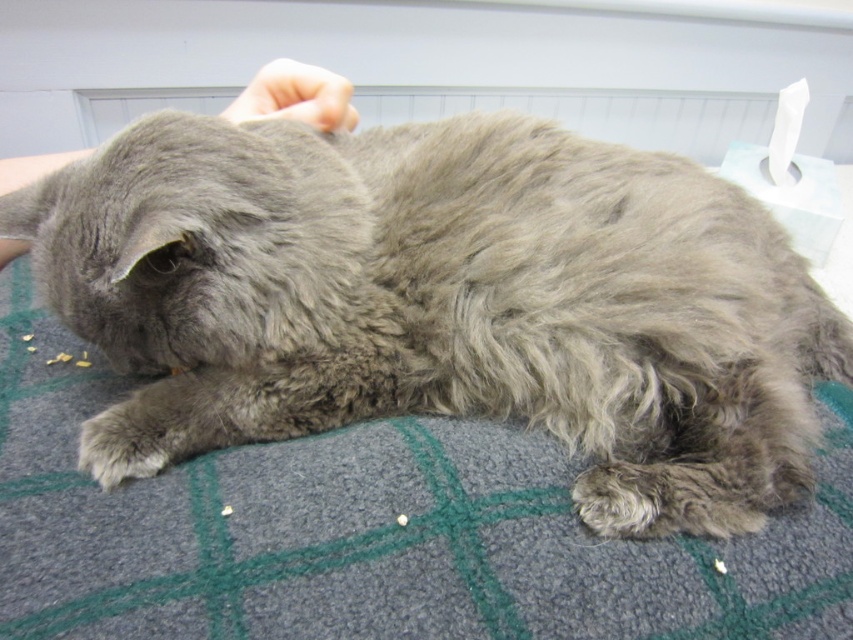
Is gray fluffy cat at center bigger than smooth skin hand at upper center?

Correct, gray fluffy cat at center is larger in size than smooth skin hand at upper center.

Is gray fluffy cat at center further to camera compared to smooth skin hand at upper center?

No.

Does point (125, 333) come farther from viewer compared to point (318, 81)?

That is False.

What are the coordinates of `gray fluffy cat at center` in the screenshot? It's located at (444, 301).